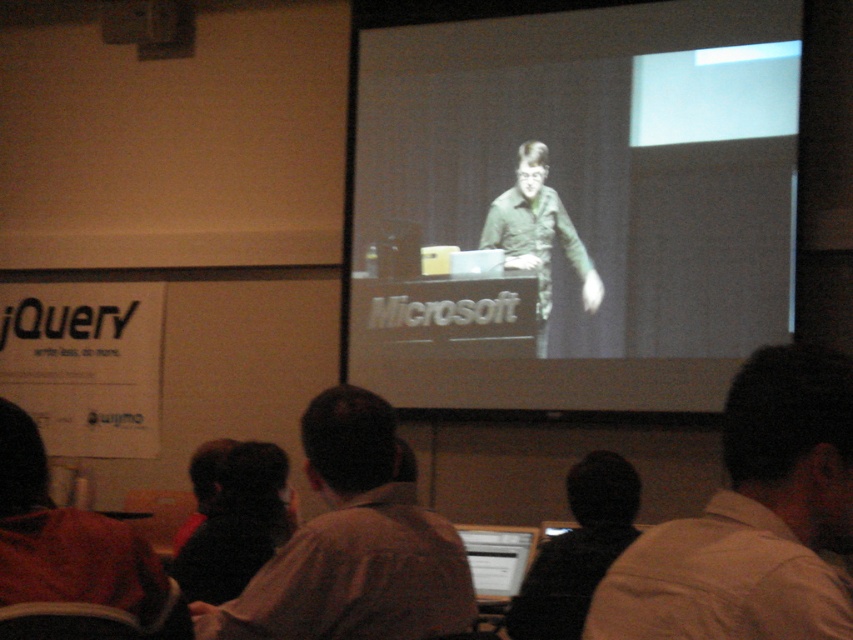
Is the position of white matte projection screen at upper center less distant than that of light brown shirt at lower right?

No, it is not.

Who is taller, white matte projection screen at upper center or light brown shirt at lower right?

Standing taller between the two is white matte projection screen at upper center.

Find the location of a particular element. The image size is (853, 640). white matte projection screen at upper center is located at coordinates [576, 204].

Where is `white matte projection screen at upper center`? white matte projection screen at upper center is located at coordinates (576, 204).

Is black fuzzy hat at lower center smaller than green matte shirt at center?

Indeed, black fuzzy hat at lower center has a smaller size compared to green matte shirt at center.

Does point (523, 636) come behind point (532, 209)?

No, it is not.

Find the location of `black fuzzy hat at lower center`. black fuzzy hat at lower center is located at coordinates (577, 548).

Is light brown shirt at center wider than green matte shirt at center?

Correct, the width of light brown shirt at center exceeds that of green matte shirt at center.

Can you confirm if light brown shirt at center is shorter than green matte shirt at center?

Correct, light brown shirt at center is not as tall as green matte shirt at center.

Where is `light brown shirt at center`? Image resolution: width=853 pixels, height=640 pixels. light brown shirt at center is located at coordinates (352, 545).

The height and width of the screenshot is (640, 853). In order to click on light brown shirt at center in this screenshot , I will do `click(352, 545)`.